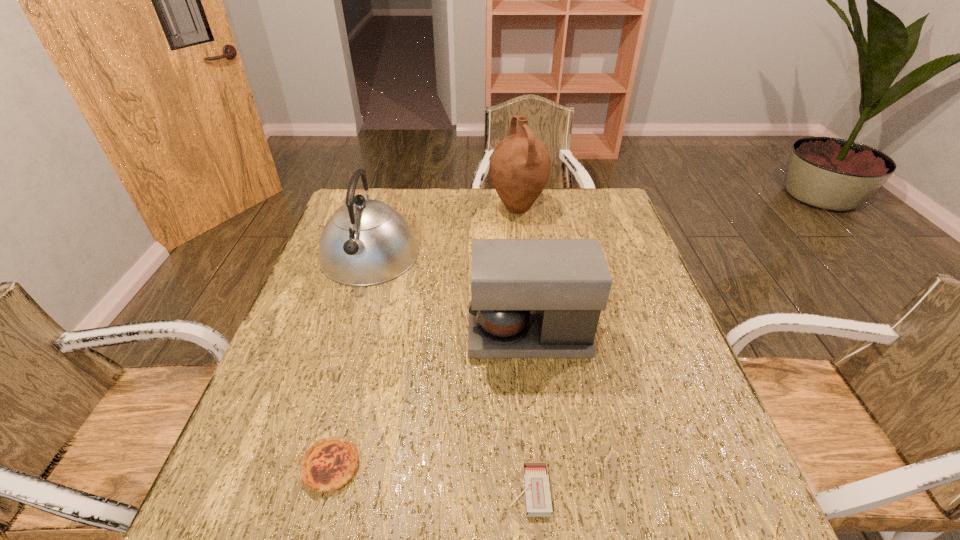
Find the location of a particular element. quiche that is at the left edge is located at coordinates (328, 465).

Identify the location of object positioned at the far left corner. (365, 242).

I want to click on object at the near left corner, so click(x=328, y=465).

I want to click on free space at the left edge of the desktop, so click(x=329, y=335).

Identify the location of vacant region at the right edge of the desktop. (662, 363).

Identify the location of empty space that is in between the coffee maker and the matchbox. This screenshot has height=540, width=960. (529, 413).

Image resolution: width=960 pixels, height=540 pixels. What are the coordinates of `empty space between the coffee maker and the quiche` in the screenshot? It's located at (430, 401).

Identify the location of free space between the third farthest object and the kettle. (449, 295).

This screenshot has height=540, width=960. Find the location of `empty location between the third nearest object and the quiche`. empty location between the third nearest object and the quiche is located at coordinates (430, 401).

The image size is (960, 540). I want to click on free space between the matchbox and the quiche, so click(430, 478).